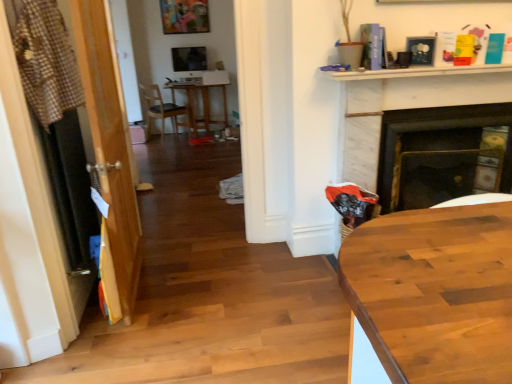
What do you see at coordinates (198, 106) in the screenshot?
I see `wooden round table at center` at bounding box center [198, 106].

What do you see at coordinates (442, 154) in the screenshot? I see `black marble fireplace at center-right` at bounding box center [442, 154].

In order to face matte wood chair at center, should I rotate leftwards or rightwards?

To align with it, rotate left about 12.311°.

Locate an element on the screen. matte black picture frame at upper right is located at coordinates (421, 50).

Can you see wooden round table at center touching satin black monitor at center?

No, wooden round table at center is not in contact with satin black monitor at center.

Relative to satin black monitor at center, is wooden round table at center in front or behind?

Visually, wooden round table at center is located in front of satin black monitor at center.

Is point (190, 102) behind point (185, 55)?

No.

From a real-world perspective, relative to satin black monitor at center, is wooden round table at center vertically above or below?

In terms of real-world spatial position, wooden round table at center is below satin black monitor at center.

Is satin black monitor at center positioned in front of wooden round table at center?

No, satin black monitor at center is behind wooden round table at center.

Would you say satin black monitor at center is a long distance from wooden round table at center?

No, satin black monitor at center is not far from wooden round table at center.

From a real-world perspective, is satin black monitor at center physically below wooden round table at center?

No, from a real-world perspective, satin black monitor at center is not under wooden round table at center.

From the image's perspective, is satin black monitor at center on top of wooden round table at center?

Yes, from the image's perspective, satin black monitor at center is above wooden round table at center.

Is matte wood chair at center far from wooden round table at center?

matte wood chair at center is actually quite close to wooden round table at center.

Does point (155, 95) appear closer or farther from the camera than point (172, 94)?

Point (155, 95) appears to be farther away from the viewer than point (172, 94).

Is matte wood chair at center to the left or to the right of wooden round table at center in the image?

From the image, it's evident that matte wood chair at center is to the left of wooden round table at center.

How much distance is there between matte wood chair at center and wooden round table at center?

They are 13.78 inches apart.

From the image's perspective, which one is positioned higher, satin black monitor at center or checkered fabric laundry at left?

satin black monitor at center, from the image's perspective.

Who is shorter, satin black monitor at center or checkered fabric laundry at left?

satin black monitor at center.

Is satin black monitor at center inside the boundaries of checkered fabric laundry at left, or outside?

satin black monitor at center is spatially situated outside checkered fabric laundry at left.

From the picture: How much distance is there between satin black monitor at center and checkered fabric laundry at left?

4.85 meters.

What are the coordinates of `fireplace above the wooden door at left (from the image's perspective)` in the screenshot? It's located at (442, 154).

Is black marble fireplace at center-right aimed at wooden door at left?

No, black marble fireplace at center-right is not turned towards wooden door at left.

Is black marble fireplace at center-right next to wooden door at left and touching it?

There is a gap between black marble fireplace at center-right and wooden door at left.

Does point (495, 109) come closer to viewer compared to point (100, 113)?

No, it is behind (100, 113).

Considering the sizes of matte wood chair at center and satin black monitor at center in the image, is matte wood chair at center wider or thinner than satin black monitor at center?

Considering their sizes, matte wood chair at center looks broader than satin black monitor at center.

From a real-world perspective, is matte wood chair at center below satin black monitor at center?

Correct, in the physical world, matte wood chair at center is lower than satin black monitor at center.

Find the location of a particular element. This screenshot has width=512, height=384. chair in front of the satin black monitor at center is located at coordinates (160, 108).

Can you confirm if matte wood chair at center is smaller than satin black monitor at center?

Incorrect, matte wood chair at center is not smaller in size than satin black monitor at center.

Considering the points (198, 108) and (105, 5), which point is in front, point (198, 108) or point (105, 5)?

The point (105, 5) is more forward.

From the image's perspective, is wooden round table at center under wooden door at left?

No, from the image's perspective, wooden round table at center is not below wooden door at left.

Is wooden round table at center placed right next to wooden door at left?

No, wooden round table at center is not with wooden door at left.

How many degrees apart are the facing directions of wooden round table at center and wooden door at left?

The angle between the facing direction of wooden round table at center and the facing direction of wooden door at left is 93.2 degrees.

Locate an element on the screen. This screenshot has width=512, height=384. television that is on the left side of wooden round table at center is located at coordinates (189, 59).

The height and width of the screenshot is (384, 512). I want to click on round table located underneath the satin black monitor at center (from a real-world perspective), so click(x=198, y=106).

Considering their positions, is wooden round table at center positioned closer to wooden door at left than matte wood chair at center?

The object closer to wooden door at left is wooden round table at center.

Estimate the real-world distances between objects in this image. Which object is further from checkered fabric laundry at left, matte black picture frame at upper right or black marble fireplace at center-right?

black marble fireplace at center-right is positioned further to the anchor checkered fabric laundry at left.

Which object lies nearer to the anchor point checkered fabric laundry at left, wooden round table at center or wooden door at left?

wooden door at left is positioned closer to the anchor checkered fabric laundry at left.

Which object lies further to the anchor point checkered fabric laundry at left, satin black monitor at center or wooden round table at center?

satin black monitor at center is positioned further to the anchor checkered fabric laundry at left.

From the picture: Looking at the image, which one is located further to matte wood chair at center, checkered fabric laundry at left or matte black picture frame at upper right?

The object further to matte wood chair at center is matte black picture frame at upper right.

Based on their spatial positions, is wooden door at left or satin black monitor at center closer to wooden round table at center?

satin black monitor at center.

From the image, which object appears to be farther from checkered fabric laundry at left, matte wood chair at center or satin black monitor at center?

The object further to checkered fabric laundry at left is satin black monitor at center.

Estimate the real-world distances between objects in this image. Which object is closer to checkered fabric laundry at left, wooden round table at center or matte wood chair at center?

Among the two, wooden round table at center is located nearer to checkered fabric laundry at left.

Find the location of a particular element. The image size is (512, 384). picture frame between wooden door at left and black marble fireplace at center-right from left to right is located at coordinates (421, 50).

This screenshot has width=512, height=384. I want to click on fireplace located between wooden door at left and matte wood chair at center in the depth direction, so click(442, 154).

Find the location of a particular element. fireplace between checkered fabric laundry at left and matte wood chair at center along the z-axis is located at coordinates (442, 154).

I want to click on picture frame between wooden door at left and wooden round table at center in the front-back direction, so click(421, 50).